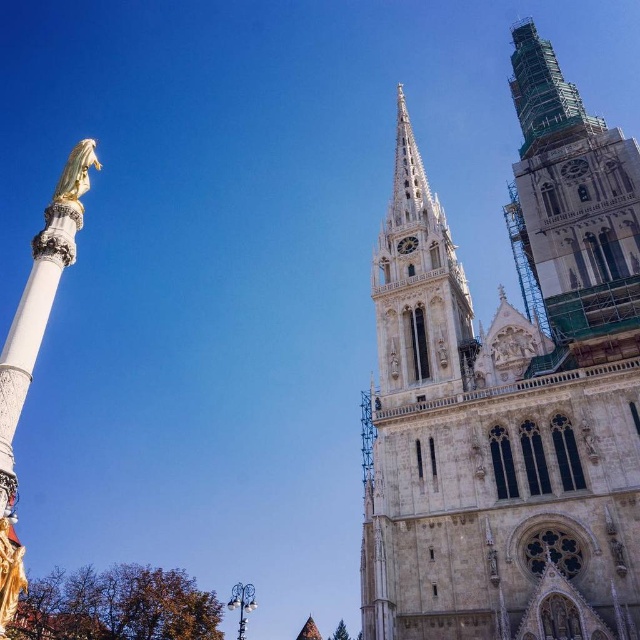
You are standing at the base of the cathedral and notice two points marked in the scene. The first point is located at coordinates point (385, 376), and the second is at point (26, 365). From your vantage point, which point is closer to you?

Point (26, 365) is closer to you because point (385, 376) is behind it.

You are standing in front of the cathedral and want to take a photo that includes both the stone spire at center and the golden statue on the column to the left. The camera you are using has a maximum zoom range of 100 feet. Can you capture both objects in a single frame without moving the camera?

The stone spire at center is 196.20 feet away from the camera. Since the camera can only zoom up to 100 feet, it cannot capture the stone spire at center within the required distance. Therefore, it is not possible to include both objects in a single frame without moving the camera.

You are standing in front of the cathedral and notice a point marked at coordinates (573, 198). Based on the scene description, what object is located at this point?

The point at coordinates (573, 198) indicates the location of the green scaffolding at right.